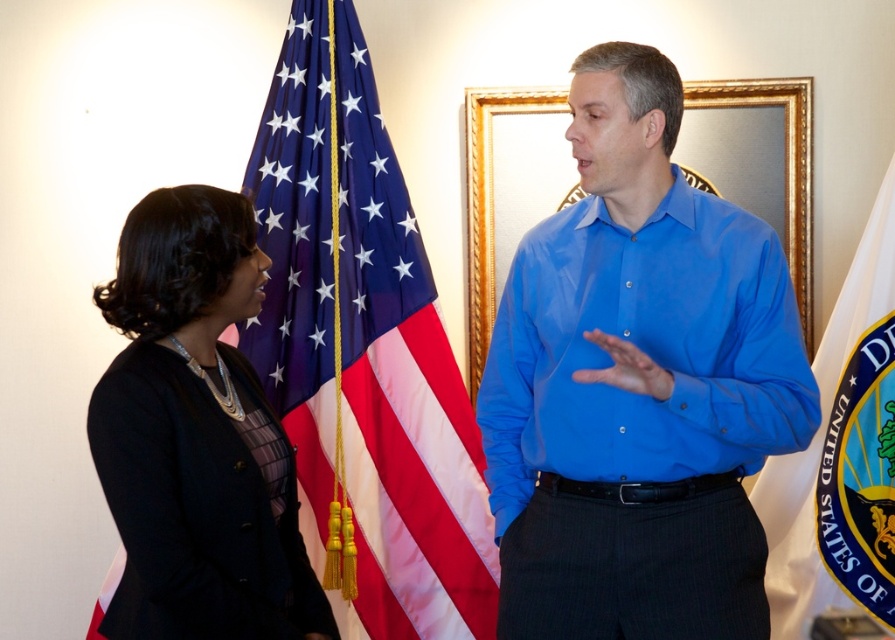
Question: Considering the relative positions of blue smooth shirt at center and blue fabric flag at center in the image provided, where is blue smooth shirt at center located with respect to blue fabric flag at center?

Choices:
 (A) above
 (B) below

Answer: (B)

Question: Among these points, which one is farthest from the camera?

Choices:
 (A) (444, 442)
 (B) (229, 378)
 (C) (828, 600)

Answer: (A)

Question: Which object is the closest to the blue smooth shirt at center?

Choices:
 (A) blue fabric flag at center
 (B) white fabric flag at right

Answer: (A)

Question: Is blue fabric flag at center wider than black fabric jacket at left?

Choices:
 (A) yes
 (B) no

Answer: (A)

Question: Can you confirm if blue fabric flag at center is wider than white fabric flag at right?

Choices:
 (A) no
 (B) yes

Answer: (B)

Question: Which point is farther to the camera?

Choices:
 (A) click(847, 298)
 (B) click(644, 132)
 (C) click(256, 556)

Answer: (A)